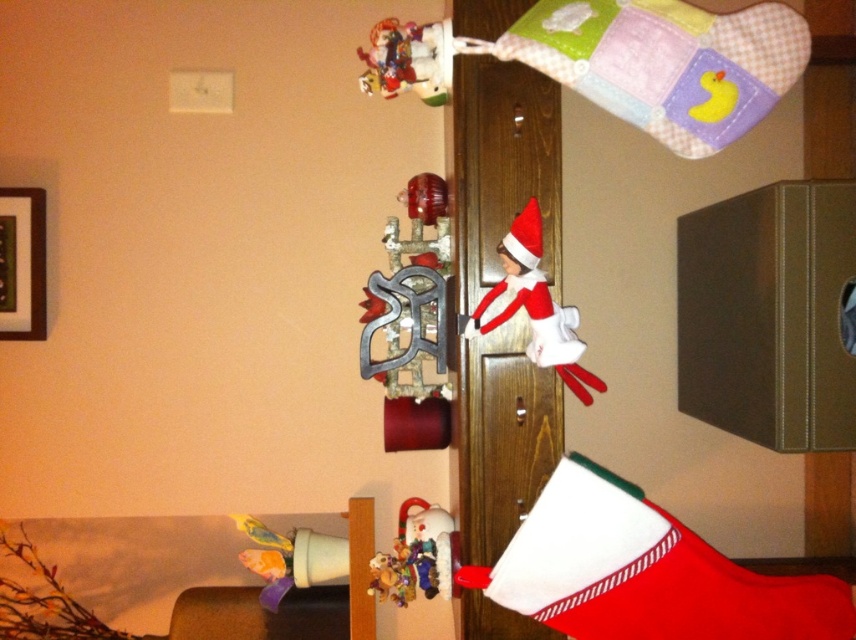
You are a child who wants to reach both the matte plastic elf at upper center and the matte plastic toy at lower left. Which one can you grab first without moving your position?

The matte plastic elf at upper center is closer to the viewer than the matte plastic toy at lower left, so you can grab the matte plastic elf at upper center first without moving your position.

Based on the photo, you are a child trying to reach the metallic silver ornament at upper center and the matte plastic elf at upper center on the door. Which object is closer to the right side of the door?

The metallic silver ornament at upper center is to the right of the matte plastic elf at upper center, so it is closer to the right side of the door.

You are hanging decorations on a Christmas door. You have a metallic silver ornament at upper center and a white fabric elf at center. Which decoration is taller?

The metallic silver ornament at upper center is much taller than the white fabric elf at center.